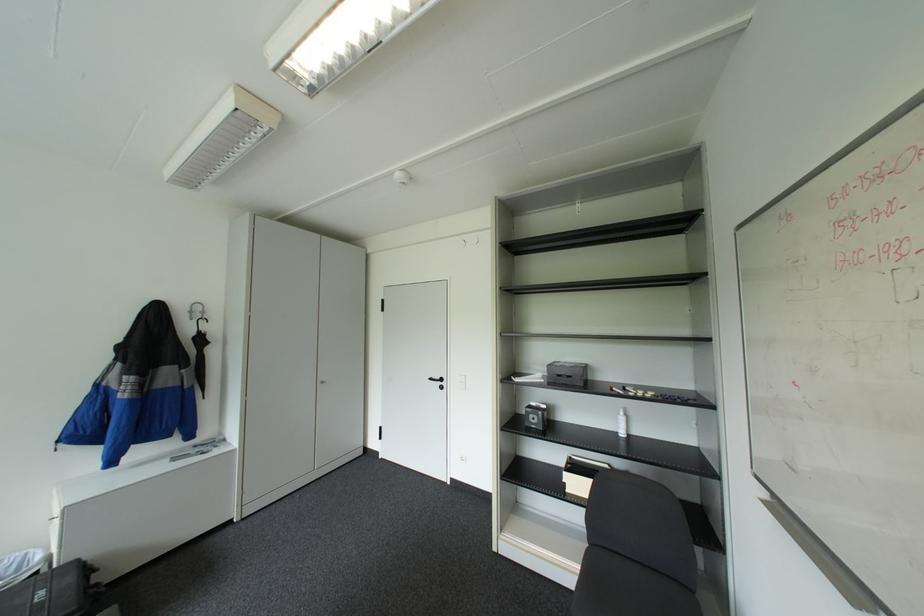
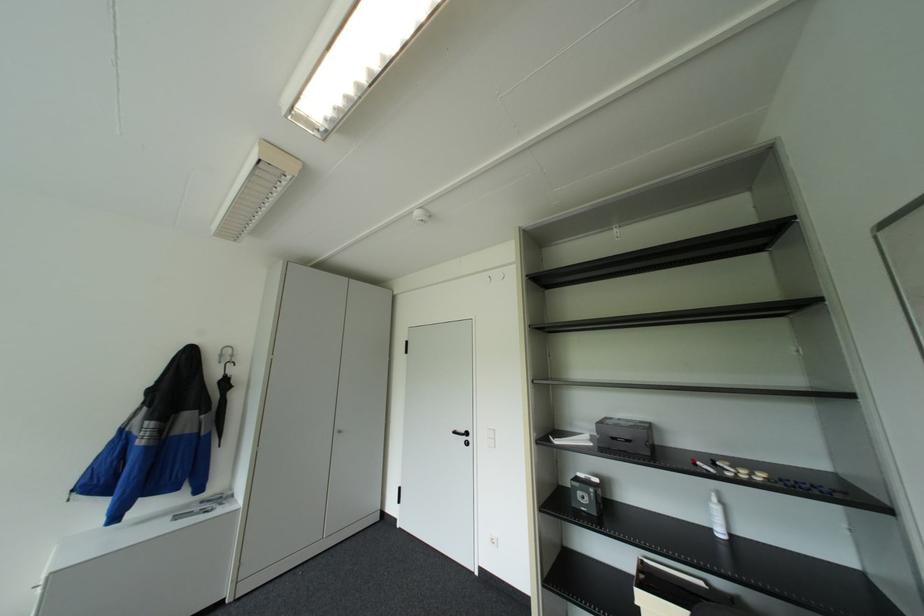
In the second image, find the point that corresponds to [541,416] in the first image.

(591, 496)